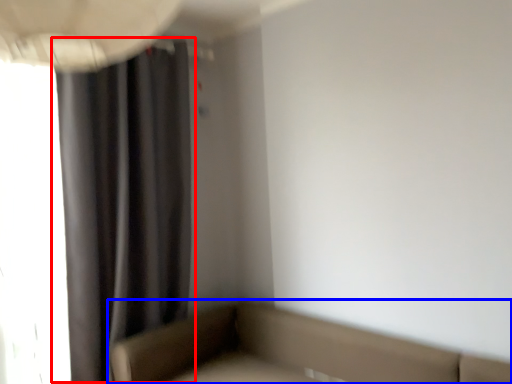
Question: Which point is further to the camera, curtain (highlighted by a red box) or studio couch (highlighted by a blue box)?

Choices:
 (A) curtain
 (B) studio couch

Answer: (A)